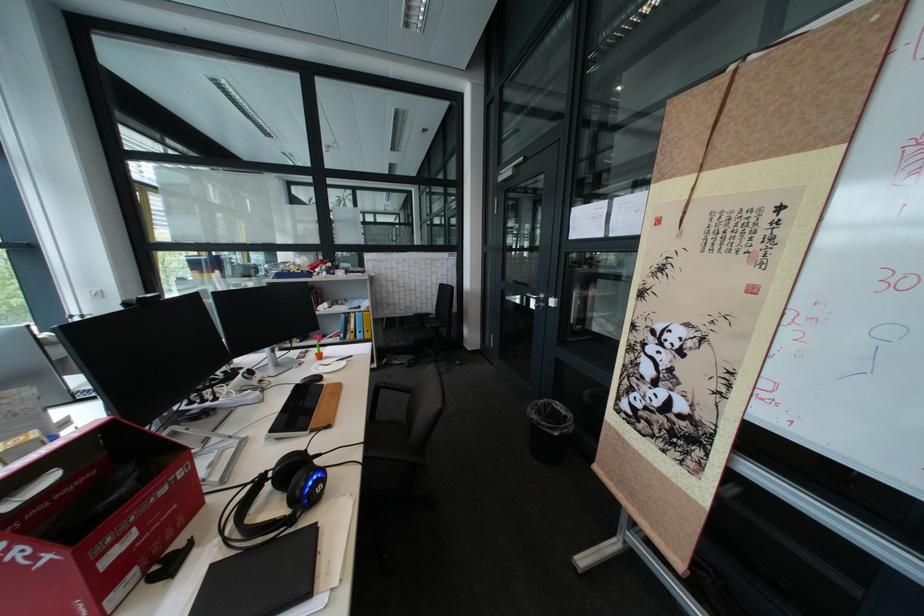
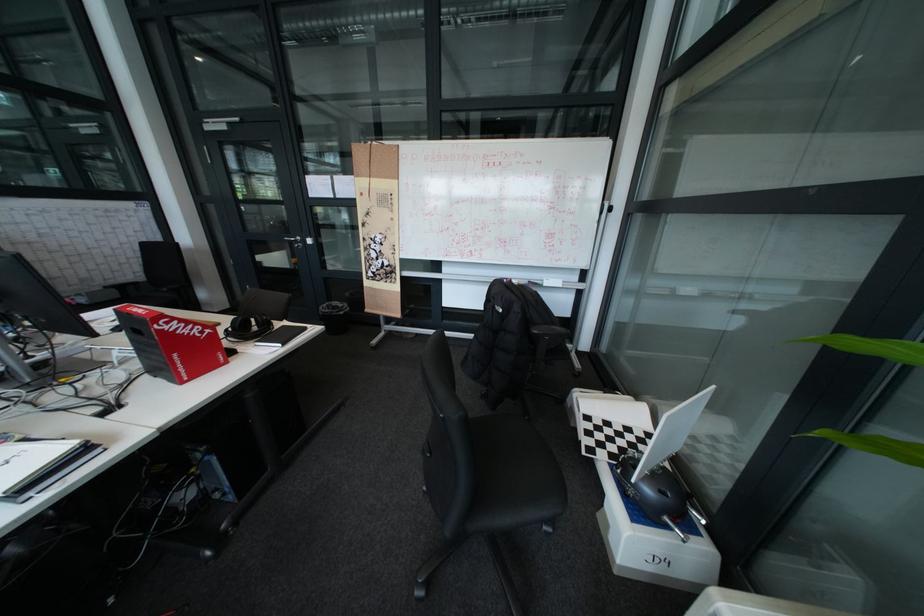
Where in the second image is the point corresponding to point (65, 561) from the first image?

(223, 333)